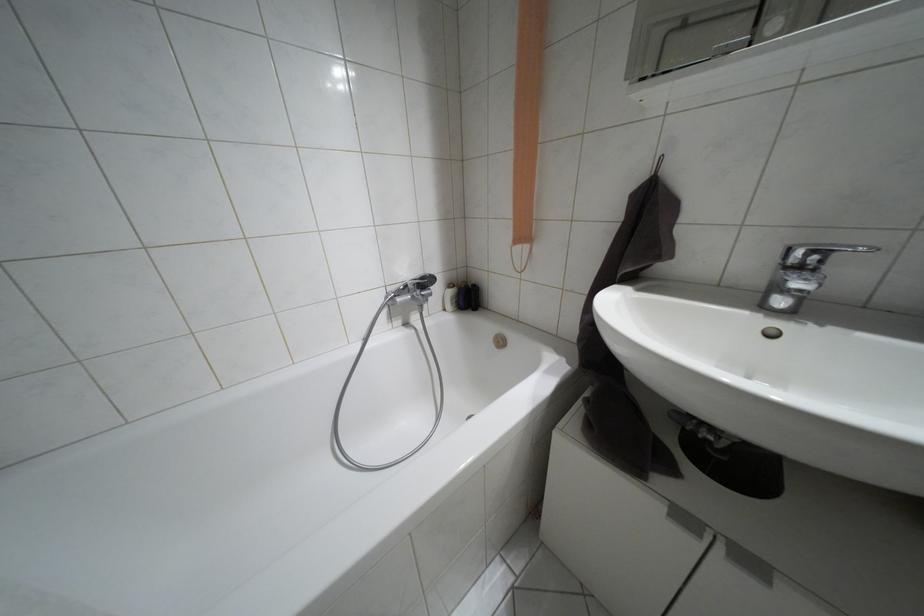
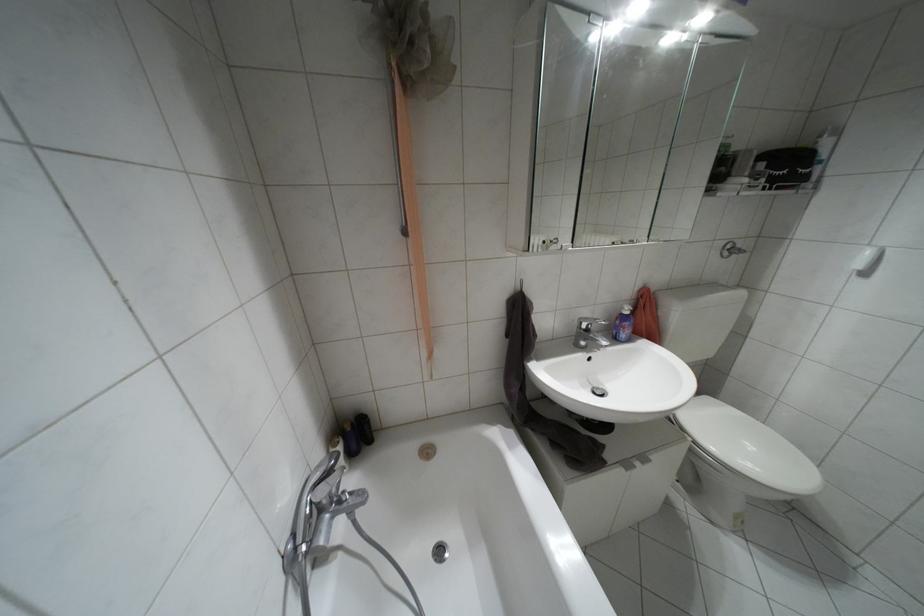
Question: The images are taken continuously from a first-person perspective. In which direction is your viewpoint rotating?

Choices:
 (A) Left
 (B) Right
 (C) Up
 (D) Down

Answer: (B)